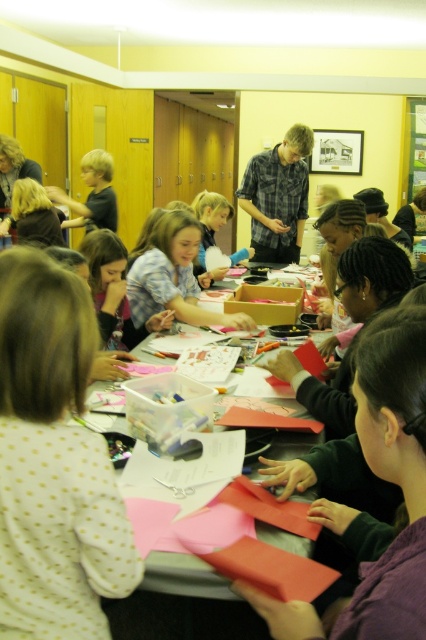
Who is positioned more to the left, pink paper at center or plaid shirt at center?

pink paper at center

How much distance is there between pink paper at center and plaid shirt at center?

pink paper at center is 3.02 meters from plaid shirt at center.

Which is behind, point (175, 486) or point (279, 253)?

Positioned behind is point (279, 253).

Locate an element on the screen. This screenshot has width=426, height=640. pink paper at center is located at coordinates pos(154,524).

What do you see at coordinates (54, 461) in the screenshot? I see `white dotted shirt at lower left` at bounding box center [54, 461].

Can you confirm if white dotted shirt at lower left is thinner than smooth red paper at center?

No.

Does point (55, 532) come closer to viewer compared to point (405, 358)?

No, (55, 532) is behind (405, 358).

Where is `white dotted shirt at lower left`? The width and height of the screenshot is (426, 640). white dotted shirt at lower left is located at coordinates (54, 461).

Is point (406, 390) positioned before point (215, 323)?

Yes, point (406, 390) is in front of point (215, 323).

Does smooth red paper at center appear over matte blue shirt at center?

Incorrect, smooth red paper at center is not positioned above matte blue shirt at center.

Where is `smooth red paper at center`? smooth red paper at center is located at coordinates (391, 449).